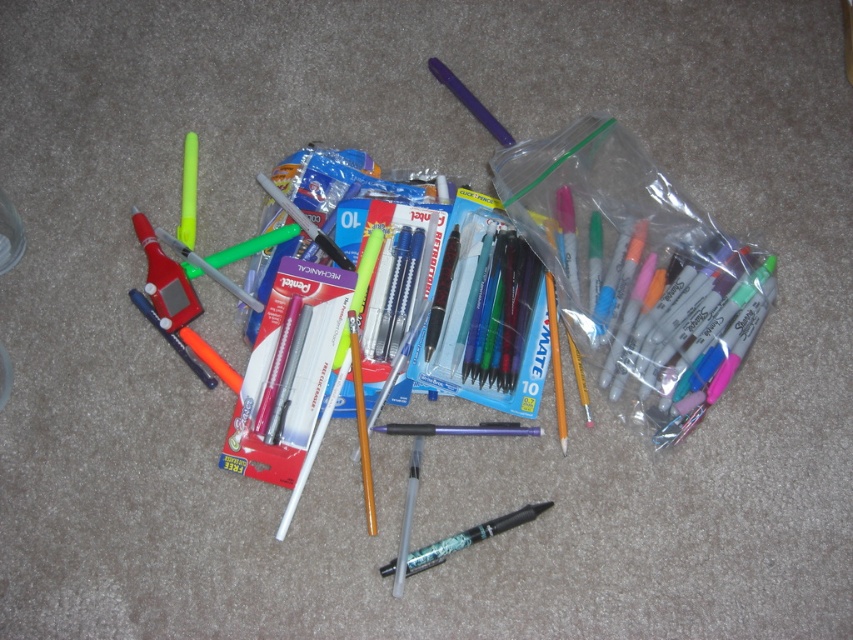
Is metallic green pen at center below translucent plastic highlighter at center-left?

Indeed, metallic green pen at center is positioned under translucent plastic highlighter at center-left.

The width and height of the screenshot is (853, 640). Find the location of `metallic green pen at center`. metallic green pen at center is located at coordinates (469, 538).

At what (x,y) coordinates should I click in order to perform the action: click on metallic green pen at center. Please return your answer as a coordinate pair (x, y). Looking at the image, I should click on (469, 538).

Can you confirm if metallic green pen at center is taller than matte plastic pen at center?

Indeed, metallic green pen at center has a greater height compared to matte plastic pen at center.

Looking at this image, measure the distance between metallic green pen at center and camera.

The distance of metallic green pen at center from camera is 4.14 feet.

I want to click on metallic green pen at center, so click(x=469, y=538).

Is matte plastic pen at center positioned before matte purple pen at upper center?

That is True.

Where is `matte plastic pen at center`? Image resolution: width=853 pixels, height=640 pixels. matte plastic pen at center is located at coordinates (457, 429).

Where is `matte plastic pen at center`? The height and width of the screenshot is (640, 853). matte plastic pen at center is located at coordinates (457, 429).